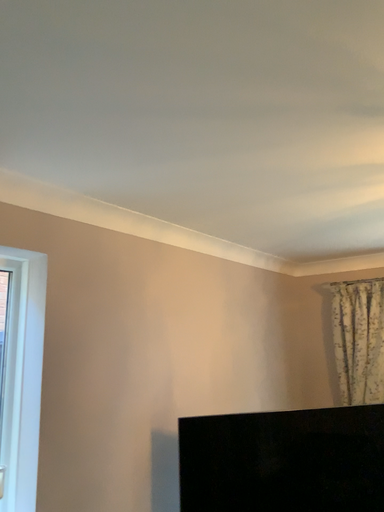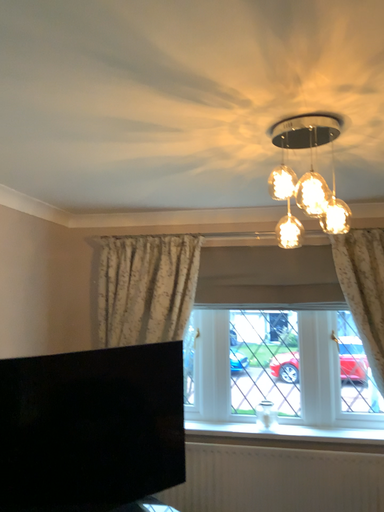
Question: How did the camera likely rotate when shooting the video?

Choices:
 (A) rotated upward
 (B) rotated downward

Answer: (B)